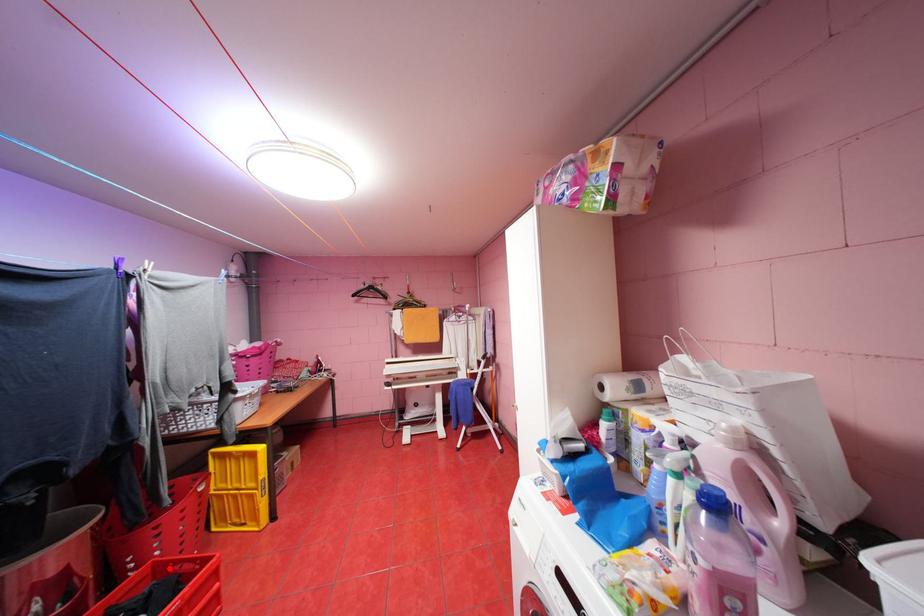
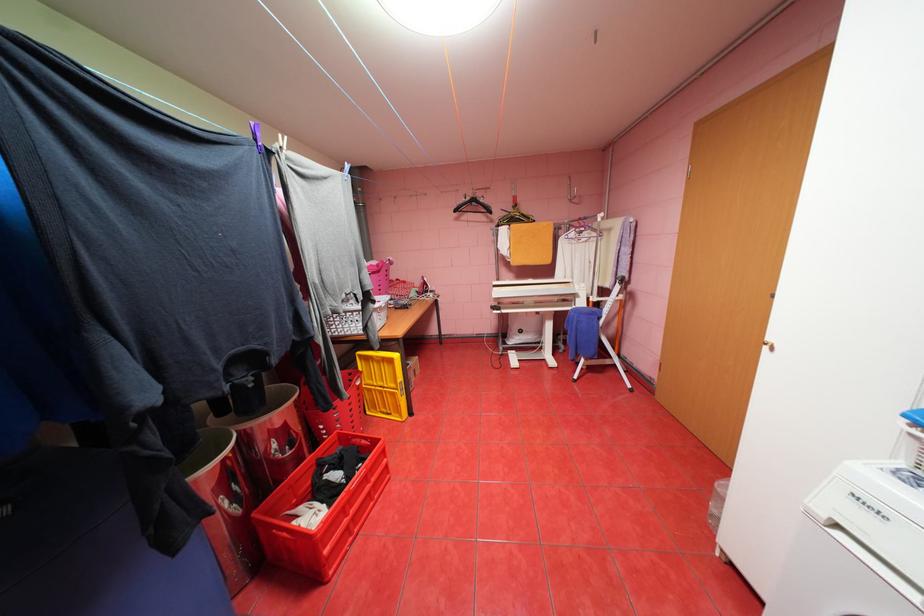
In the second image, find the point that corresponds to the highlighted location in the first image.

(351, 438)